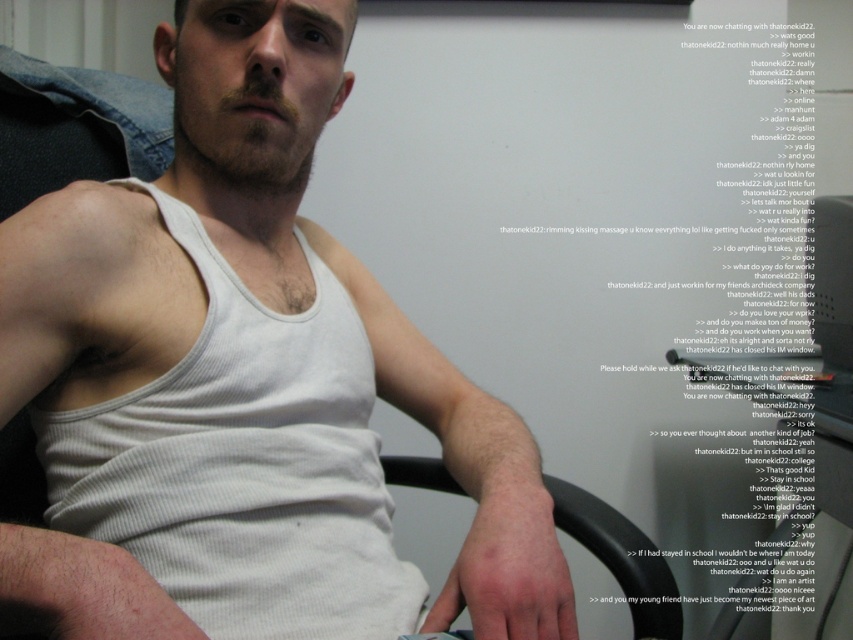
Question: Which of the following is the closest to the observer?

Choices:
 (A) black plastic chair at lower center
 (B) white ribbed tank top at center

Answer: (B)

Question: Which object appears farthest from the camera in this image?

Choices:
 (A) black plastic chair at lower center
 (B) white ribbed tank top at center

Answer: (A)

Question: Can you confirm if white ribbed tank top at center is bigger than black plastic chair at lower center?

Choices:
 (A) no
 (B) yes

Answer: (B)

Question: Can you confirm if white ribbed tank top at center is positioned below black plastic chair at lower center?

Choices:
 (A) yes
 (B) no

Answer: (B)

Question: Which of the following is the farthest from the observer?

Choices:
 (A) black plastic chair at lower center
 (B) white ribbed tank top at center

Answer: (A)

Question: Does white ribbed tank top at center appear on the right side of black plastic chair at lower center?

Choices:
 (A) yes
 (B) no

Answer: (B)